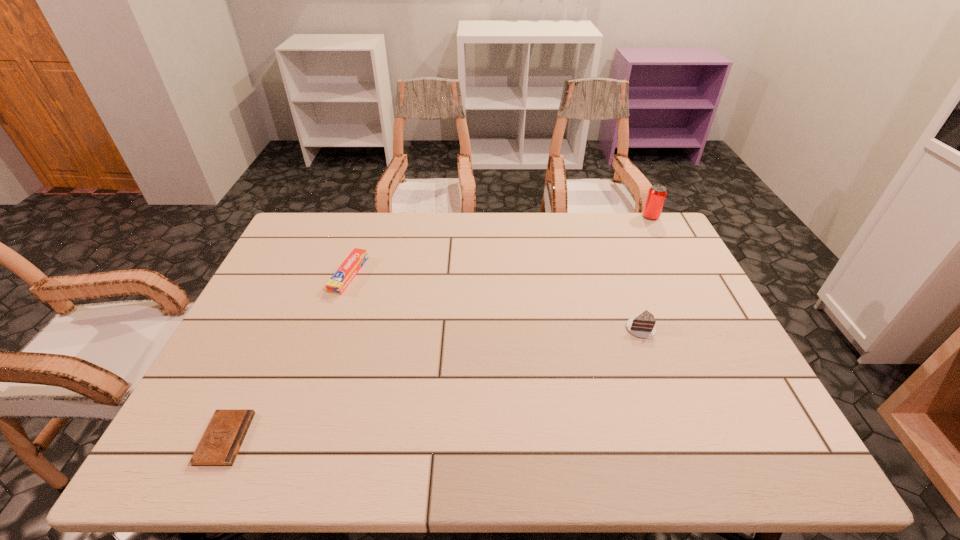
Identify the location of vacant space at the left edge of the desktop. (224, 372).

In the image, there is a desktop. Identify the location of vacant space at the right edge. This screenshot has height=540, width=960. (650, 271).

Image resolution: width=960 pixels, height=540 pixels. I want to click on free location at the far left corner of the desktop, so click(311, 243).

Locate an element on the screen. vacant space at the near left corner of the desktop is located at coordinates (189, 428).

Where is `free space at the far right corner of the desktop`? This screenshot has height=540, width=960. free space at the far right corner of the desktop is located at coordinates (668, 245).

Locate an element on the screen. This screenshot has height=540, width=960. free space between the leftmost object and the rightmost object is located at coordinates (438, 328).

Identify the location of empty location between the third shortest object and the rightmost object. Image resolution: width=960 pixels, height=540 pixels. (646, 273).

Identify the location of free space that is in between the third nearest object and the third shortest object. This screenshot has height=540, width=960. (495, 302).

The height and width of the screenshot is (540, 960). What are the coordinates of `free space that is in between the third object from left to right and the tallest object` in the screenshot? It's located at tap(646, 273).

Where is `vacant space in between the second tallest object and the diary`? This screenshot has height=540, width=960. vacant space in between the second tallest object and the diary is located at coordinates (433, 384).